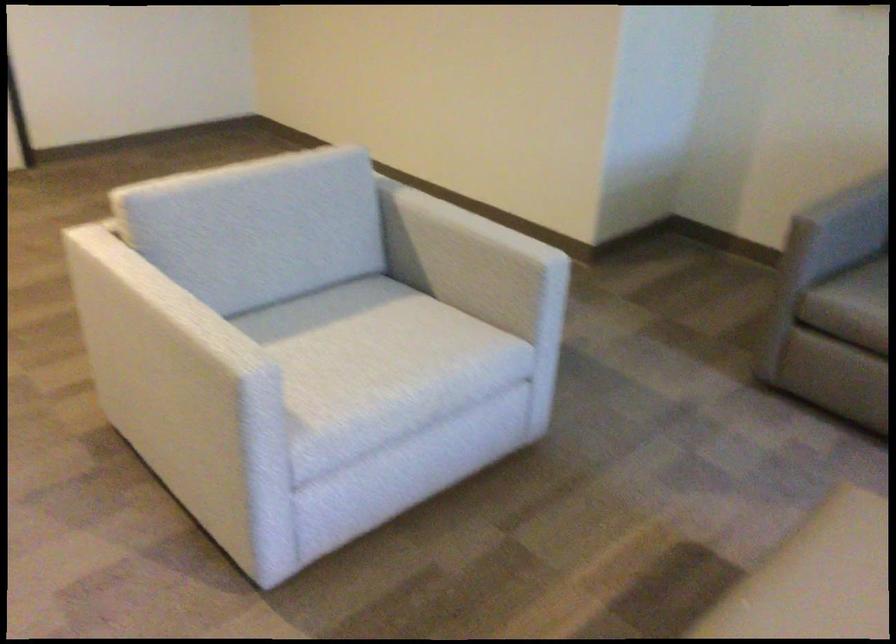
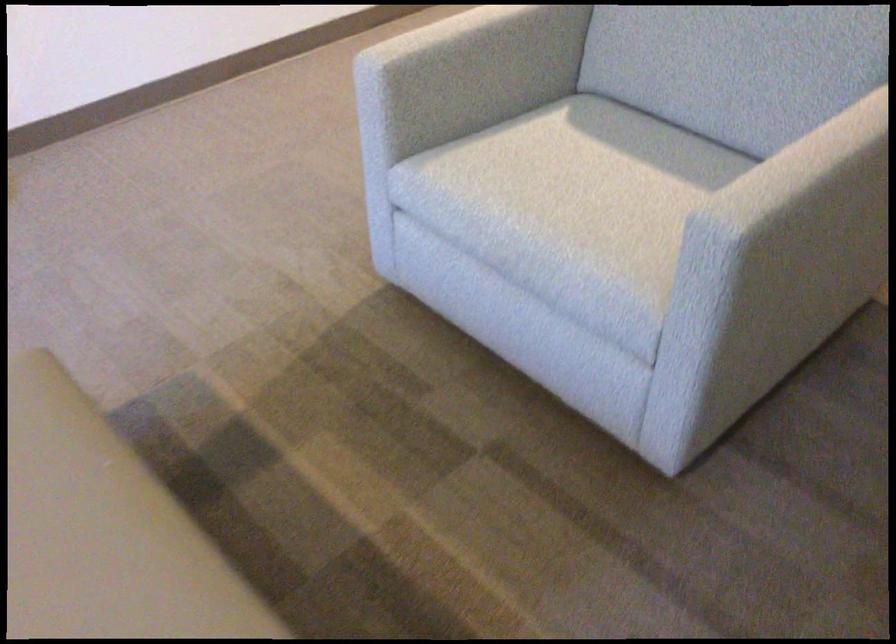
The point at (329,336) is marked in the first image. Where is the corresponding point in the second image?

(607, 169)